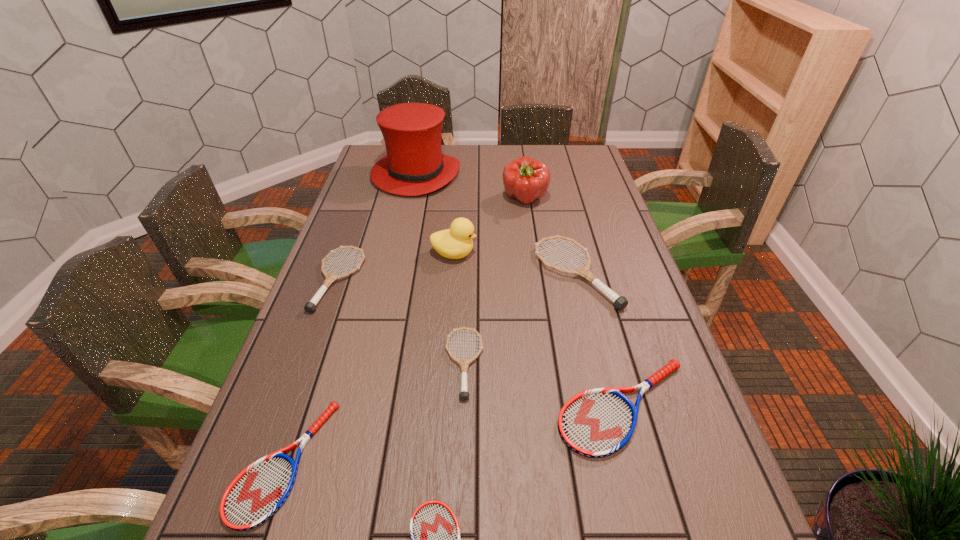
Where is `free area in between the second gray tennis racket from left to right and the sixth shortest object`? free area in between the second gray tennis racket from left to right and the sixth shortest object is located at coordinates (520, 319).

The width and height of the screenshot is (960, 540). In order to click on vacant area that lies between the tallest object and the biggest blue tennis racket in this screenshot , I will do `click(520, 291)`.

The width and height of the screenshot is (960, 540). I want to click on vacant area between the hat and the rightmost blue tennis racket, so click(520, 291).

Locate an element on the screen. This screenshot has width=960, height=540. free area in between the biggest gray tennis racket and the biggest blue tennis racket is located at coordinates (600, 340).

Identify the location of blank region between the duck and the tallest object. (435, 214).

Where is `vacant point located between the pepper and the rightmost blue tennis racket`? This screenshot has height=540, width=960. vacant point located between the pepper and the rightmost blue tennis racket is located at coordinates (574, 303).

At what (x,y) coordinates should I click in order to perform the action: click on object that is the fifth nearest to the second gray tennis racket from left to right. Please return your answer as a coordinate pair (x, y). The height and width of the screenshot is (540, 960). Looking at the image, I should click on (454, 243).

Find the location of a particular element. Image resolution: width=960 pixels, height=540 pixels. the seventh closest object to the biggest blue tennis racket is located at coordinates (525, 179).

Point out which tennis racket is positioned as the nearest to the seventh shortest object. Please provide its 2D coordinates. Your answer should be formatted as a tuple, i.e. [(x, y)], where the tuple contains the x and y coordinates of a point satisfying the conditions above.

[(620, 302)]

At what (x,y) coordinates should I click in order to perform the action: click on tennis racket that is the closest to the biggest blue tennis racket. Please return your answer as a coordinate pair (x, y). Looking at the image, I should click on (464, 363).